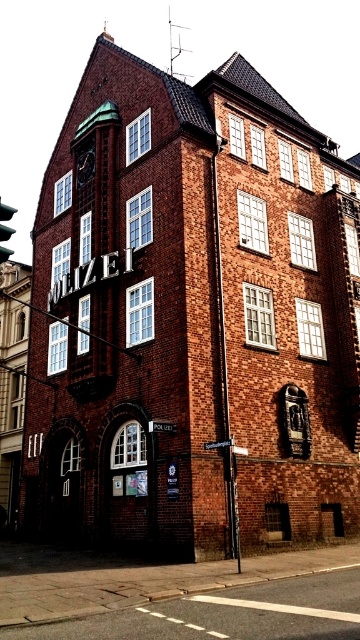
Is brass clock face at upper left smaller than red glass traffic light at left?

Correct, brass clock face at upper left occupies less space than red glass traffic light at left.

The height and width of the screenshot is (640, 360). I want to click on brass clock face at upper left, so click(x=84, y=163).

The height and width of the screenshot is (640, 360). Find the location of `brass clock face at upper left`. brass clock face at upper left is located at coordinates (84, 163).

Where is `red glass traffic light at left`? This screenshot has width=360, height=640. red glass traffic light at left is located at coordinates (6, 211).

From the picture: Is red glass traffic light at left further to the viewer compared to metallic silver street sign at center?

That is False.

The image size is (360, 640). What are the coordinates of `red glass traffic light at left` in the screenshot? It's located at (x=6, y=211).

Is brass clock face at upper left taller than metallic silver street sign at center?

Incorrect, brass clock face at upper left's height is not larger of metallic silver street sign at center's.

Does point (75, 168) come farther from viewer compared to point (231, 444)?

Yes.

Locate an element on the screen. Image resolution: width=360 pixels, height=640 pixels. brass clock face at upper left is located at coordinates tap(84, 163).